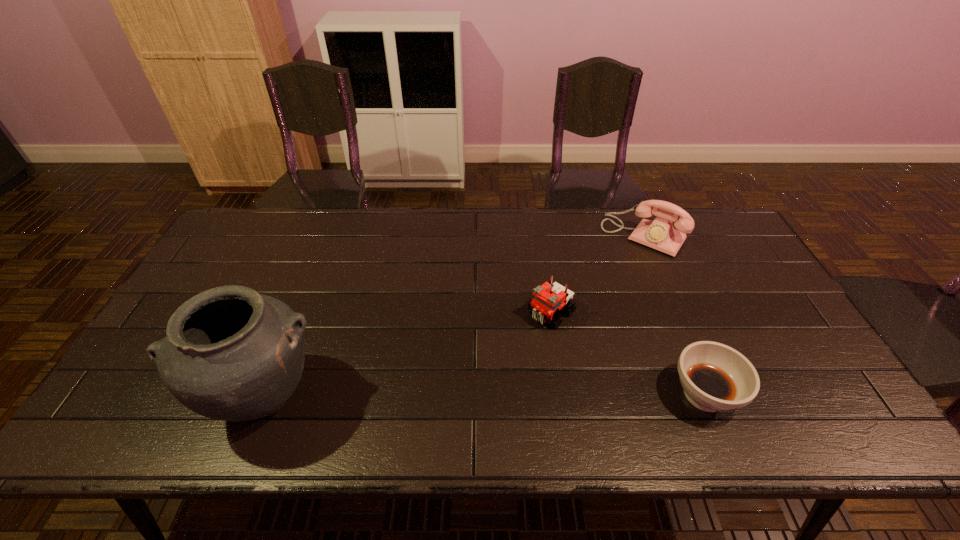
The height and width of the screenshot is (540, 960). What are the coordinates of `vacant space at the left edge` in the screenshot? It's located at (229, 282).

Where is `free spot at the right edge of the desktop`? free spot at the right edge of the desktop is located at coordinates (801, 346).

Identify the location of vacant space at the far right corner of the desktop. (684, 208).

Identify the location of empty location between the soup bowl and the tallest object. [x=485, y=396].

Where is `free space that is in between the tallest object and the third shortest object`? The image size is (960, 540). free space that is in between the tallest object and the third shortest object is located at coordinates (454, 316).

The image size is (960, 540). In order to click on vacant point located between the second tallest object and the second shortest object in this screenshot , I will do `click(598, 274)`.

This screenshot has height=540, width=960. Find the location of `unoccupied area between the Lego and the telephone`. unoccupied area between the Lego and the telephone is located at coordinates (598, 274).

The height and width of the screenshot is (540, 960). What are the coordinates of `vacant point located between the shortest object and the farthest object` in the screenshot? It's located at (674, 315).

What are the coordinates of `free spot between the third shortest object and the tallest object` in the screenshot? It's located at (454, 316).

The width and height of the screenshot is (960, 540). I want to click on unoccupied position between the tallest object and the soup bowl, so click(x=485, y=396).